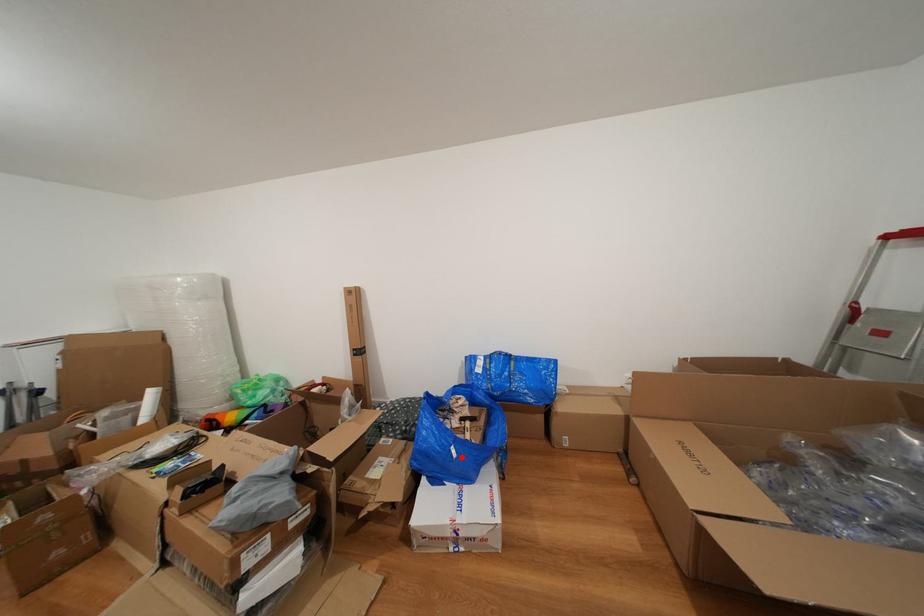
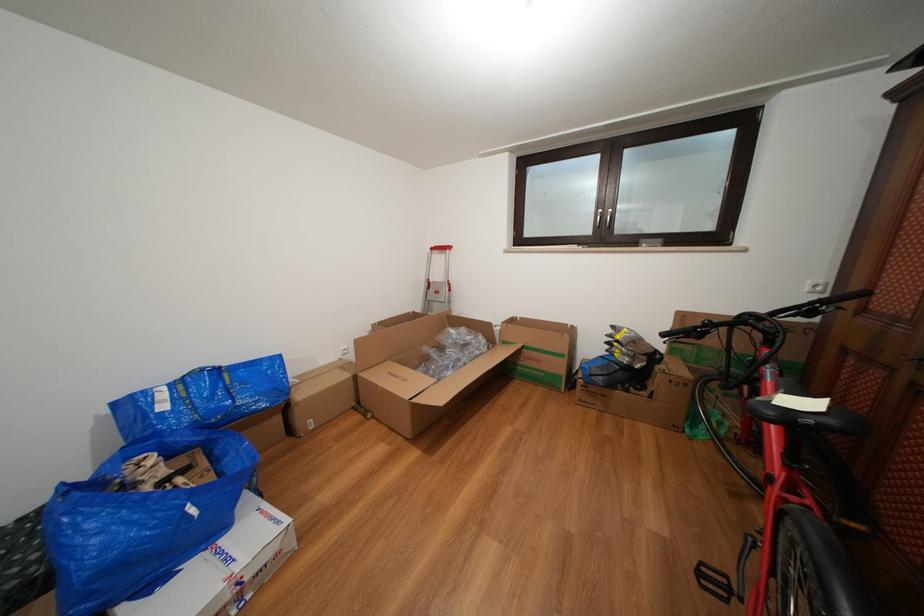
In the second image, find the point that corresponds to the highlighted location in the first image.

(201, 516)